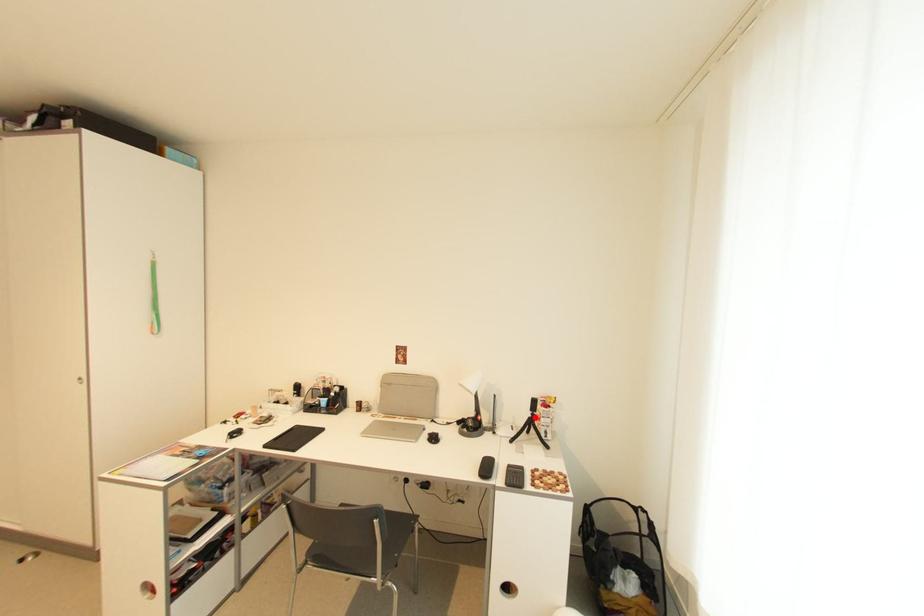
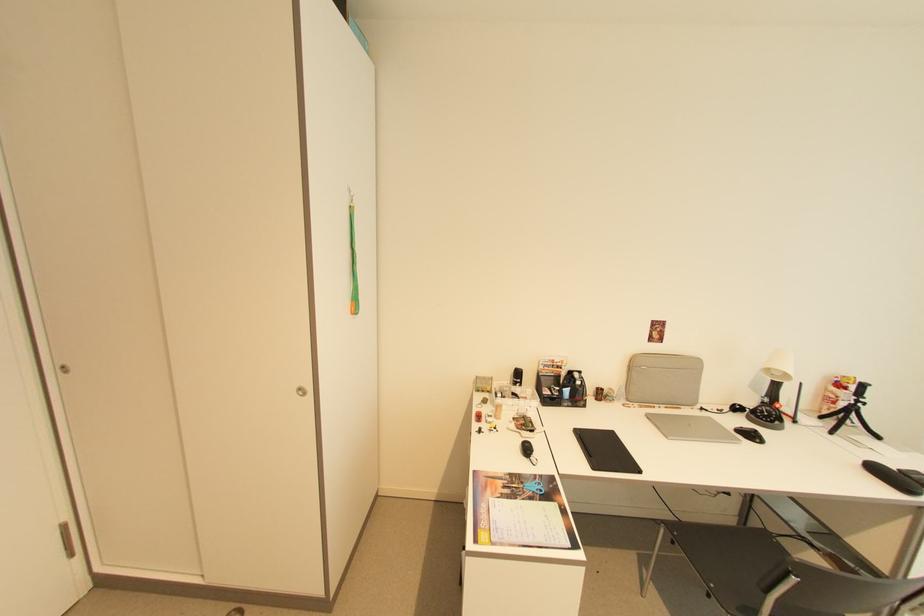
The point at the highlighted location is marked in the first image. Where is the corresponding point in the second image?

(857, 405)